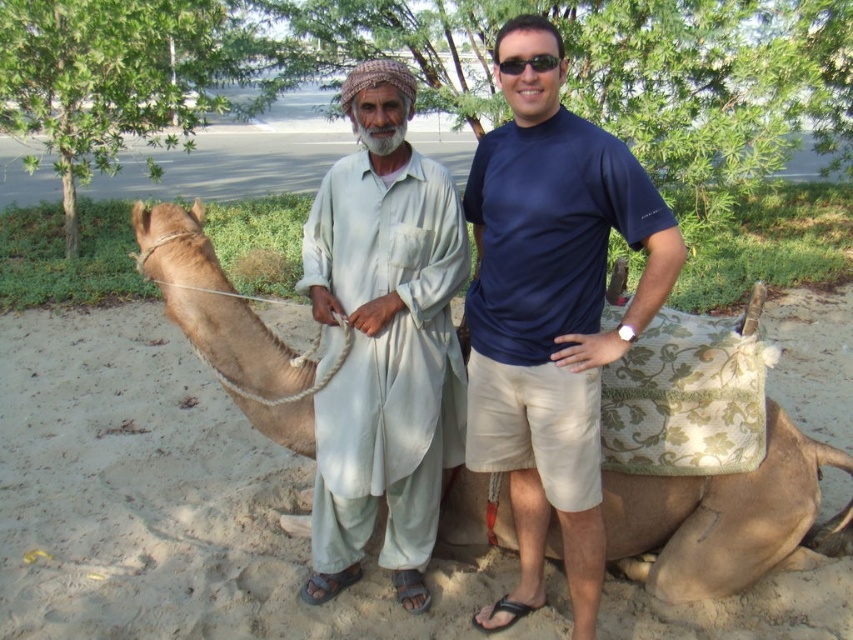
In the scene shown: Who is more distant from viewer, (544, 32) or (549, 67)?

The point (549, 67) is more distant.

Is the position of blue cotton t-shirt at center more distant than that of black plastic sunglasses at center?

Yes, it is behind black plastic sunglasses at center.

Which is in front, point (598, 442) or point (555, 61)?

Point (555, 61) is in front.

Identify the location of blue cotton t-shirt at center. This screenshot has width=853, height=640. (550, 314).

Measure the distance between blue cotton t-shirt at center and camera.

Answer: They are 2.32 meters apart.

From the picture: Who is positioned more to the left, blue cotton t-shirt at center or light beige fabric at center?

From the viewer's perspective, light beige fabric at center appears more on the left side.

This screenshot has width=853, height=640. Identify the location of blue cotton t-shirt at center. (550, 314).

This screenshot has width=853, height=640. Identify the location of blue cotton t-shirt at center. (550, 314).

Is light beige fabric at center taller than black plastic sunglasses at center?

Yes, light beige fabric at center is taller than black plastic sunglasses at center.

The image size is (853, 640). I want to click on light beige fabric at center, so click(384, 340).

Is point (437, 228) positioned behind point (508, 74)?

That is True.

Where is `light beige fabric at center`? light beige fabric at center is located at coordinates click(384, 340).